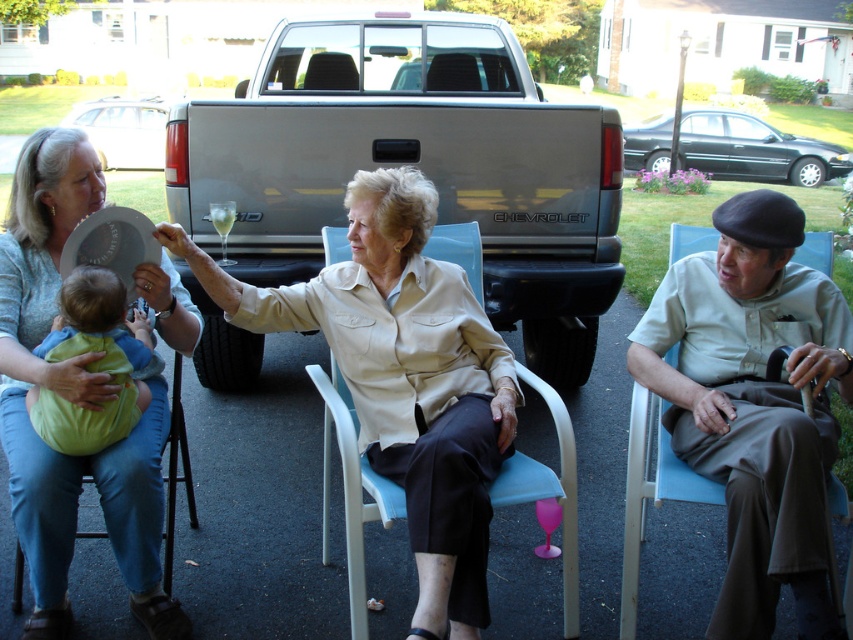
Is light beige shirt at center closer to camera compared to soft green fabric baby at center left?

Yes, light beige shirt at center is closer to the viewer.

Can you confirm if light beige shirt at center is shorter than soft green fabric baby at center left?

In fact, light beige shirt at center may be taller than soft green fabric baby at center left.

Between point (788, 509) and point (125, 376), which one is positioned behind?

Point (125, 376)

Identify the location of light beige shirt at center. This screenshot has width=853, height=640. (753, 404).

Where is `light beige shirt at center`? The image size is (853, 640). light beige shirt at center is located at coordinates (753, 404).

Can you confirm if light beige shirt at center is smaller than matte beige blouse at center?

Yes, light beige shirt at center is smaller than matte beige blouse at center.

Describe the element at coordinates (753, 404) in the screenshot. Image resolution: width=853 pixels, height=640 pixels. I see `light beige shirt at center` at that location.

You are a GUI agent. You are given a task and a screenshot of the screen. Output one action in this format:
    pyautogui.click(x=<x>, y=<y>)
    Task: Click on the light beige shirt at center
    
    Given the screenshot: What is the action you would take?
    pyautogui.click(x=753, y=404)

Is point (439, 522) farther from camera compared to point (102, 362)?

That is False.

Does point (265, 300) come in front of point (73, 324)?

No, it is not.

In the scene shown: Who is more distant from viewer, (444, 564) or (141, 312)?

Positioned behind is point (141, 312).

What are the coordinates of `beige fabric chair at center` in the screenshot? It's located at (403, 378).